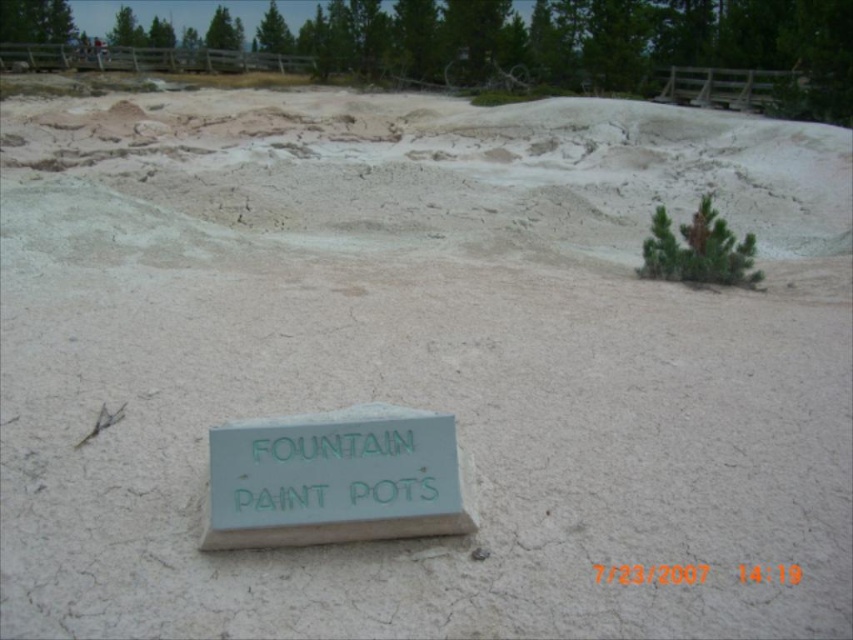
Question: Does green painted wood sign at lower center appear over green leafy pine at upper right?

Choices:
 (A) yes
 (B) no

Answer: (B)

Question: Is green painted wood sign at lower center thinner than green leafy pine at upper right?

Choices:
 (A) yes
 (B) no

Answer: (A)

Question: Is green painted wood sign at lower center positioned before green leafy pine at upper right?

Choices:
 (A) no
 (B) yes

Answer: (B)

Question: Among these points, which one is nearest to the camera?

Choices:
 (A) (354, 513)
 (B) (685, 253)

Answer: (A)